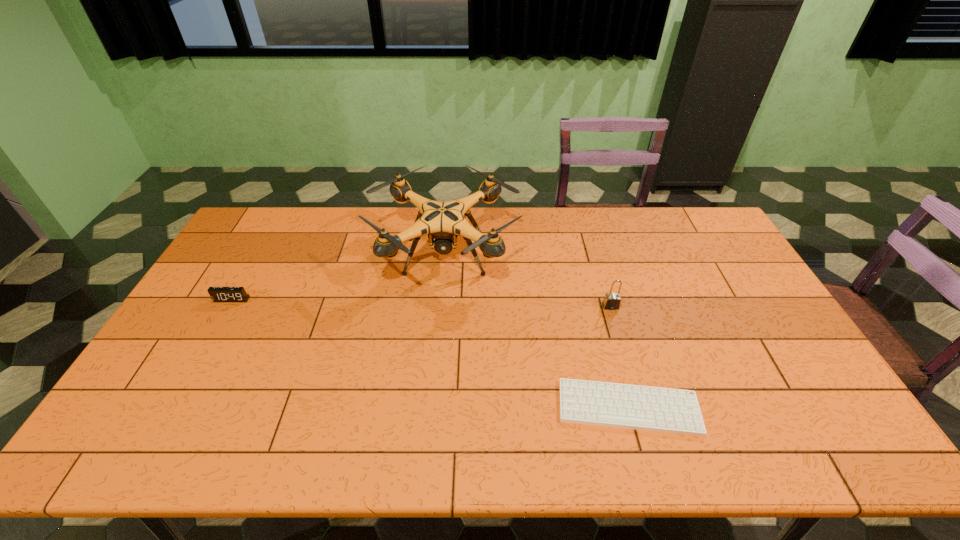
This screenshot has height=540, width=960. Identify the location of vacant region that satisfies the following two spatial constraints: 1. on the camera mount of the drone; 2. on the right side of the shortest object. (432, 408).

You are a GUI agent. You are given a task and a screenshot of the screen. Output one action in this format:
    pyautogui.click(x=<x>, y=<y>)
    Task: Click on the free space that satisfies the following two spatial constraints: 1. on the front-facing side of the nearest object; 2. on the right side of the alarm clock
    
    Given the screenshot: What is the action you would take?
    pyautogui.click(x=170, y=408)